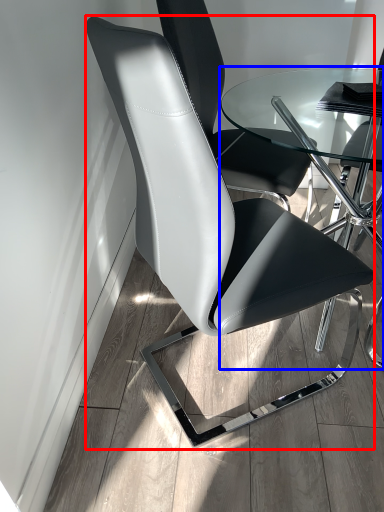
Question: Which point is further to the camera, chair (highlighted by a red box) or table (highlighted by a blue box)?

Choices:
 (A) chair
 (B) table

Answer: (B)